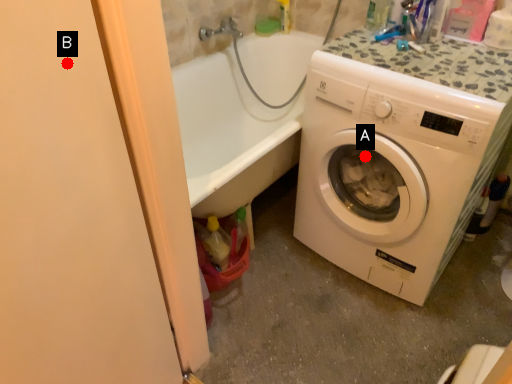
Question: Two points are circled on the image, labeled by A and B beside each circle. Which of the following is the closest to the observer?

Choices:
 (A) A is closer
 (B) B is closer

Answer: (B)